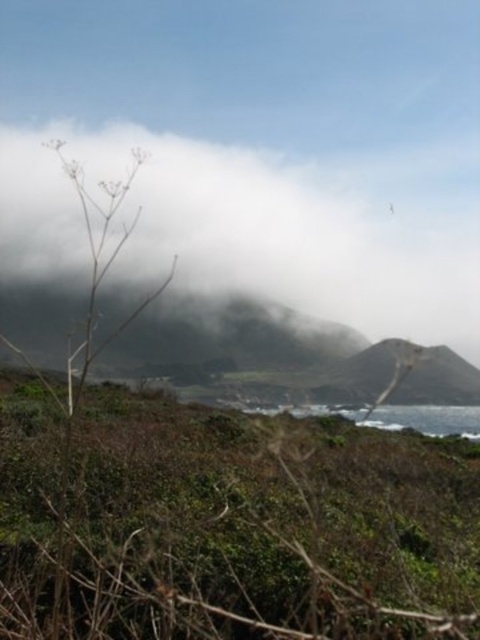
Looking at this image, based on the scene description, where is the green leafy shrubs at center located in terms of 2D coordinates?

The green leafy shrubs at center are located at the 2D coordinates of point (229, 524).